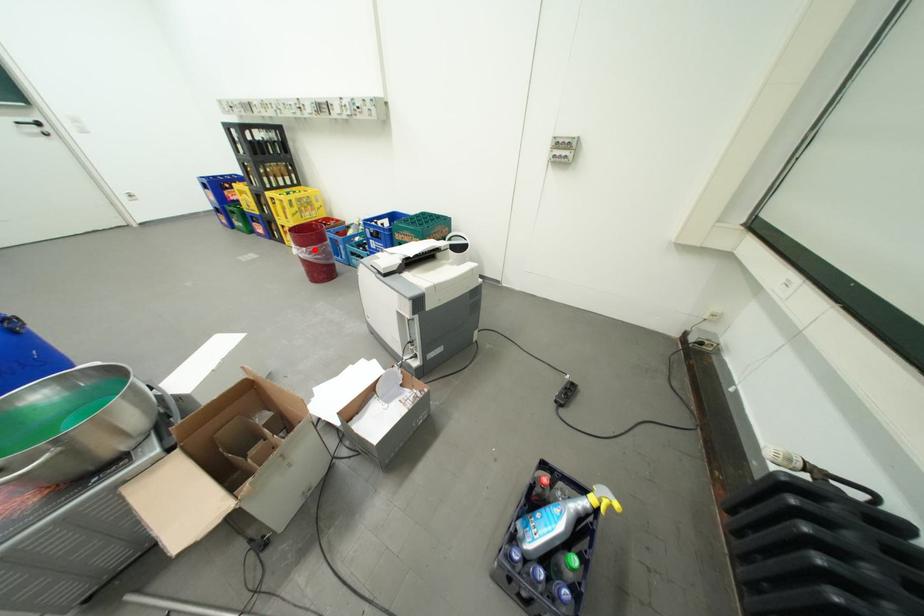
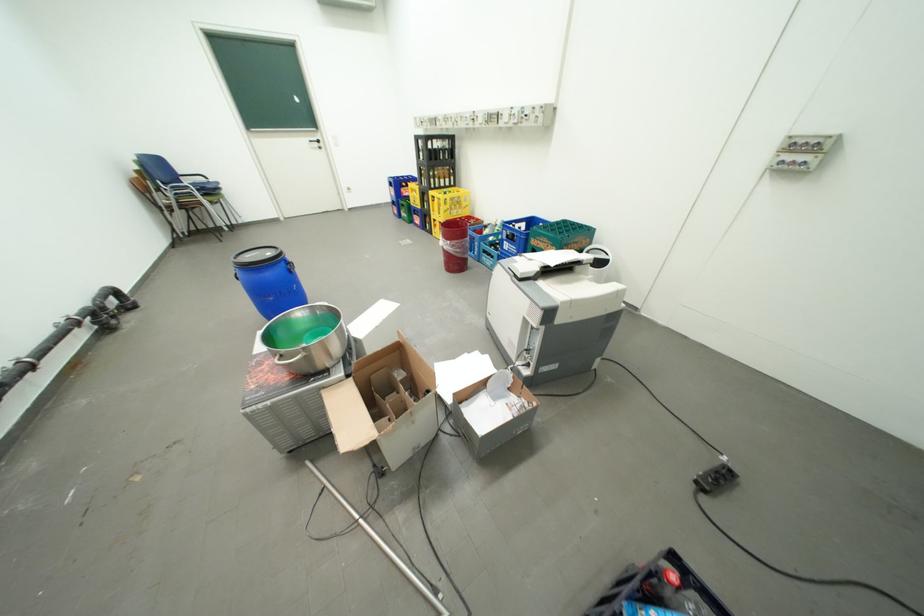
The point at the highlighted location is marked in the first image. Where is the corresponding point in the second image?

(459, 243)